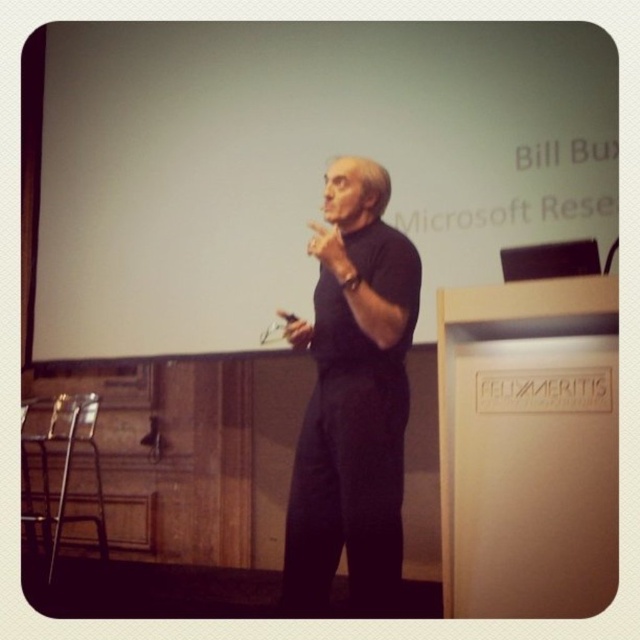
You are an event organizer who needs to adjust the lighting for a presentation. The stage has a white matte projection screen at upper left. Where should you position the spotlight to ensure it illuminates the screen without affecting the speaker? Please provide coordinates in the format of a point with two decimal places.

The white matte projection screen at upper left is located at point (x=300, y=163). To position the spotlight so it illuminates the screen without affecting the speaker, place it at approximately (x=300, y=160).

Consider the image. You are an event organizer who needs to set up a microphone stand for the speaker. The stand requires a minimum of 2 meters of space in front of it to avoid blocking the screen. Given the distance of the white matte projection screen at upper left, is the current setup feasible?

The white matte projection screen at upper left is 2.47 meters from viewer, which exceeds the required 2 meters, so the setup is feasible as the microphone stand can be placed without blocking the screen.

You are an event organizer who needs to ensure the speaker can see the screen clearly. Given the positions of the white matte projection screen at upper left and the black matte shirt at center, which object is wider and might block the speaker from viewing the screen?

The white matte projection screen at upper left is wider than the black matte shirt at center, so the screen is wider and might block the speaker from viewing the screen.